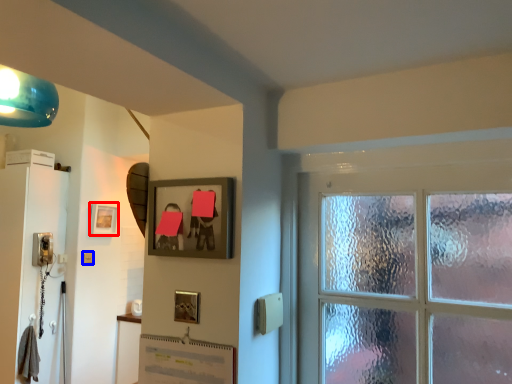
Question: Among these objects, which one is nearest to the camera, picture frame (highlighted by a red box) or light switch (highlighted by a blue box)?

Choices:
 (A) picture frame
 (B) light switch

Answer: (B)